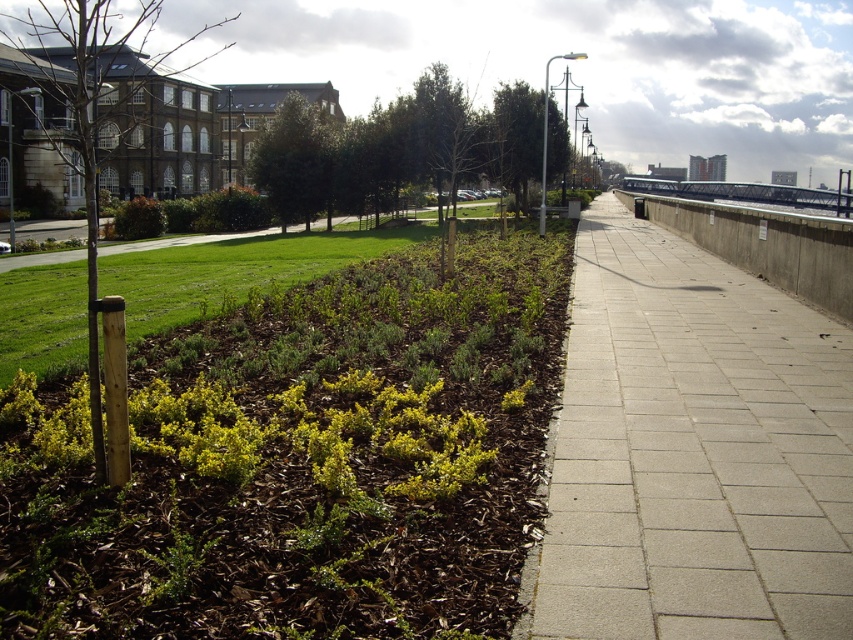
Which is behind, point (12, 497) or point (701, 577)?

The point (12, 497) is behind.

Between green mulch at lower left and gray concrete sidewalk at center, which one is positioned higher?

gray concrete sidewalk at center is higher up.

Does point (461, 257) lie behind point (837, 436)?

Yes, it is behind point (837, 436).

Identify the location of green mulch at lower left. point(300,460).